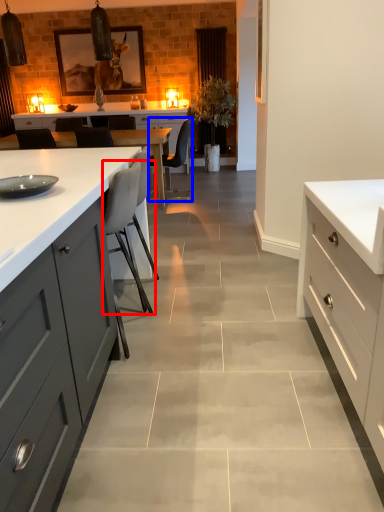
Question: Among these objects, which one is farthest to the camera, chair (highlighted by a red box) or chair (highlighted by a blue box)?

Choices:
 (A) chair
 (B) chair

Answer: (B)